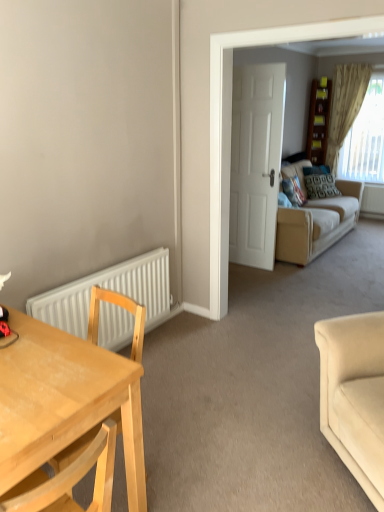
The width and height of the screenshot is (384, 512). In order to click on empty space that is ontop of light wood desk at left (from a real-world perspective) in this screenshot , I will do `click(39, 362)`.